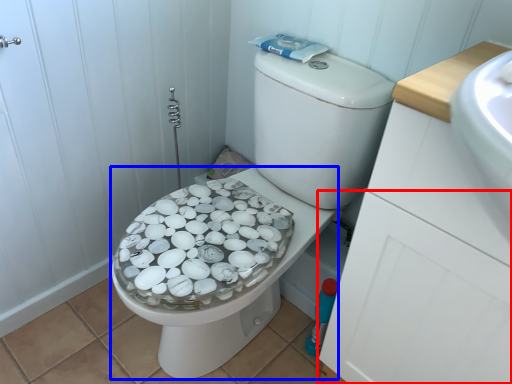
Question: Which of the following is the farthest to the observer, drawer (highlighted by a red box) or bidet (highlighted by a blue box)?

Choices:
 (A) drawer
 (B) bidet

Answer: (B)